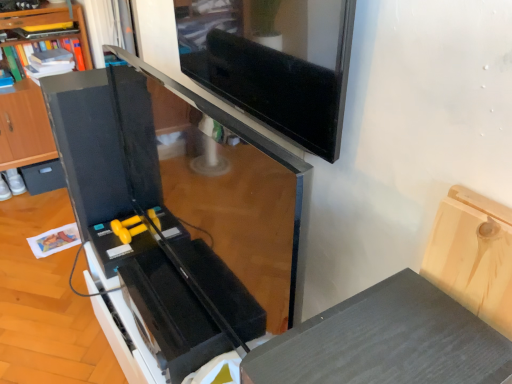
Image resolution: width=512 pixels, height=384 pixels. What do you see at coordinates (42, 177) in the screenshot? I see `black matte drawer at lower left` at bounding box center [42, 177].

Identify the location of black matte drawer at lower left. (42, 177).

At what (x,y) coordinates should I click in order to perform the action: click on black matte shelf at left. Please return your answer as a coordinate pair (x, y). This screenshot has height=384, width=512. Looking at the image, I should click on (24, 127).

The height and width of the screenshot is (384, 512). What do you see at coordinates (24, 127) in the screenshot?
I see `black matte shelf at left` at bounding box center [24, 127].

Identify the location of black matte drawer at lower left. Image resolution: width=512 pixels, height=384 pixels. (42, 177).

In the image, is black matte shelf at left on the left side or the right side of black matte drawer at lower left?

From the image, it's evident that black matte shelf at left is to the right of black matte drawer at lower left.

Is black matte shelf at left in front of or behind black matte drawer at lower left in the image?

Visually, black matte shelf at left is located in front of black matte drawer at lower left.

Which is less distant, [37,107] or [63,184]?

The point [37,107] is more forward.

From the image's perspective, is black matte shelf at left positioned above or below black matte drawer at lower left?

black matte shelf at left is situated higher than black matte drawer at lower left in the image.

From a real-world perspective, does black matte shelf at left stand above black matte drawer at lower left?

Yes, from a real-world perspective, black matte shelf at left is above black matte drawer at lower left.

Does black matte shelf at left have a greater width compared to black matte drawer at lower left?

Indeed, black matte shelf at left has a greater width compared to black matte drawer at lower left.

Which of these two, black matte shelf at left or black matte drawer at lower left, stands shorter?

With less height is black matte drawer at lower left.

Which of these two, black matte shelf at left or black matte drawer at lower left, is smaller?

black matte drawer at lower left.

Can black matte drawer at lower left be found inside black matte shelf at left?

Absolutely, black matte drawer at lower left is inside black matte shelf at left.

Is black matte shelf at left beside black matte drawer at lower left?

No, black matte shelf at left is not in contact with black matte drawer at lower left.

Is black matte shelf at left aimed at black matte drawer at lower left?

No, black matte shelf at left is not facing towards black matte drawer at lower left.

Locate an element on the screen. This screenshot has width=512, height=384. drawer to the left of black matte shelf at left is located at coordinates (42, 177).

From the picture: Can you confirm if black matte drawer at lower left is positioned to the left of black matte shelf at left?

Yes, black matte drawer at lower left is to the left of black matte shelf at left.

Considering their positions, is black matte drawer at lower left located in front of or behind black matte shelf at left?

black matte drawer at lower left is positioned farther from the viewer than black matte shelf at left.

Which point is more distant from viewer, (x=39, y=182) or (x=48, y=7)?

The point (x=39, y=182) is farther.

From the image's perspective, is black matte drawer at lower left under black matte shelf at left?

Yes, from the image's perspective, black matte drawer at lower left is below black matte shelf at left.

From a real-world perspective, is black matte drawer at lower left below black matte shelf at left?

Yes, from a real-world perspective, black matte drawer at lower left is under black matte shelf at left.

Considering the sizes of objects black matte drawer at lower left and black matte shelf at left in the image provided, who is wider, black matte drawer at lower left or black matte shelf at left?

black matte shelf at left is wider.

From their relative heights in the image, would you say black matte drawer at lower left is taller or shorter than black matte shelf at left?

In the image, black matte drawer at lower left appears to be shorter than black matte shelf at left.

Between black matte drawer at lower left and black matte shelf at left, which one has larger size?

black matte shelf at left is bigger.

Would you say black matte drawer at lower left is inside or outside black matte shelf at left?

black matte drawer at lower left fits inside black matte shelf at left.

Would you say black matte drawer at lower left is a long distance from black matte shelf at left?

black matte drawer at lower left is actually quite close to black matte shelf at left.

Is black matte drawer at lower left turned away from black matte shelf at left?

Correct, black matte drawer at lower left is looking away from black matte shelf at left.

Locate an element on the screen. The width and height of the screenshot is (512, 384). shelf above the black matte drawer at lower left (from the image's perspective) is located at coordinates (24, 127).

Locate an element on the screen. Image resolution: width=512 pixels, height=384 pixels. drawer behind the black matte shelf at left is located at coordinates (42, 177).

The height and width of the screenshot is (384, 512). I want to click on shelf above the black matte drawer at lower left (from the image's perspective), so click(24, 127).